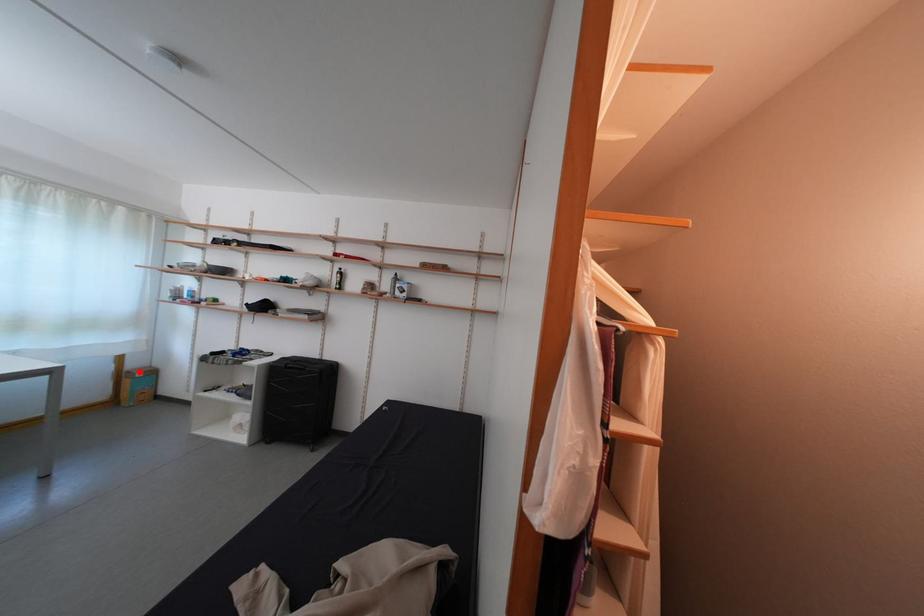
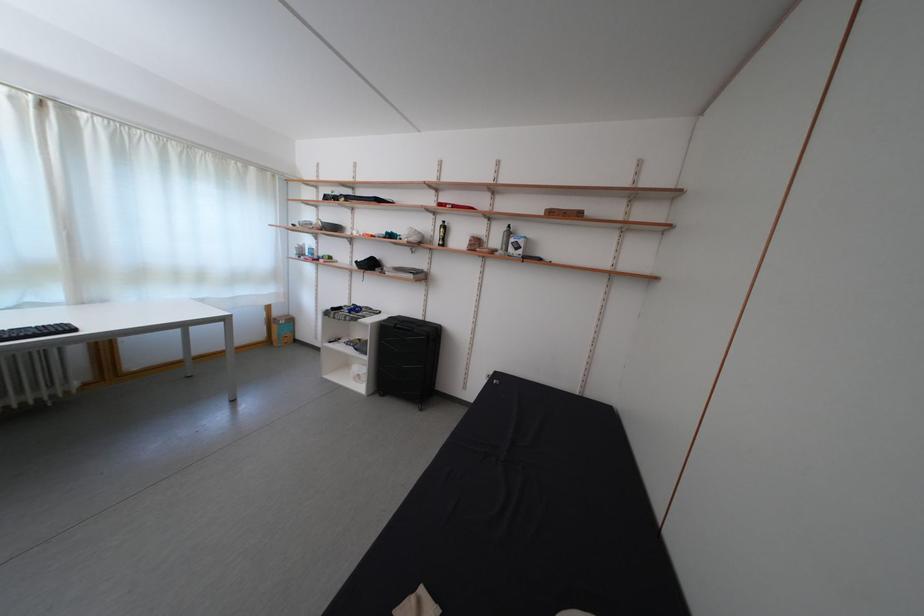
Question: A red point is marked in image1. In image2, is the corresponding 3D point closer to the camera or farther? Reply with the corresponding letter.

Choices:
 (A) The corresponding 3D point is closer.
 (B) The corresponding 3D point is farther.

Answer: (B)